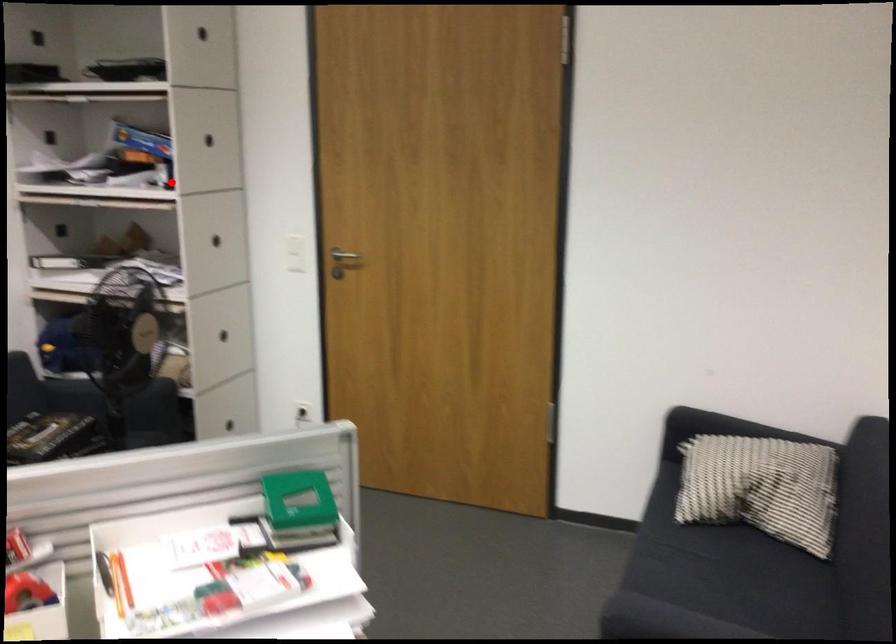
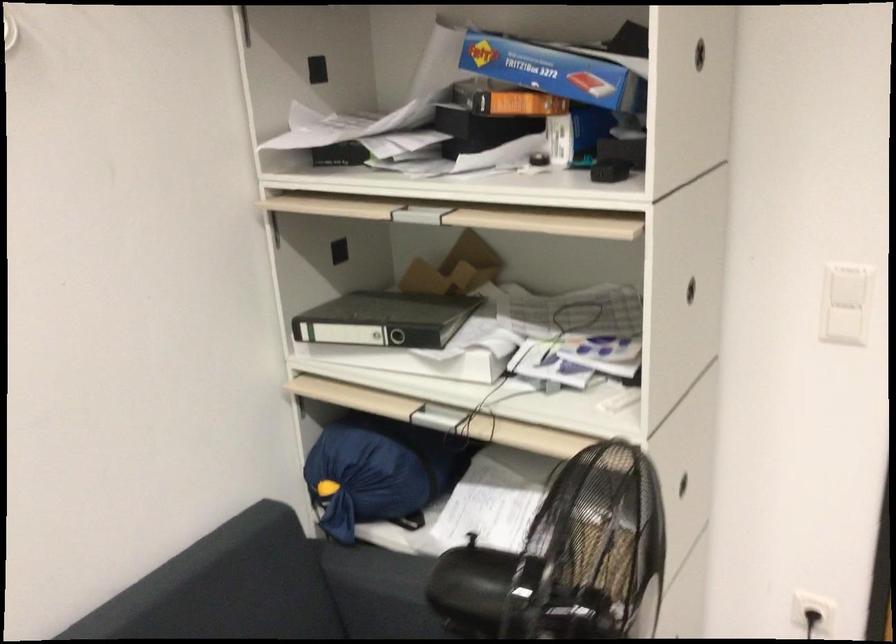
Question: I am providing you with two images of the same scene from different viewpoints. Image1 has a red point marked. In image2, the corresponding 3D location appears at what relative position? Reply with the corresponding letter.

Choices:
 (A) Closer
 (B) Farther

Answer: (A)